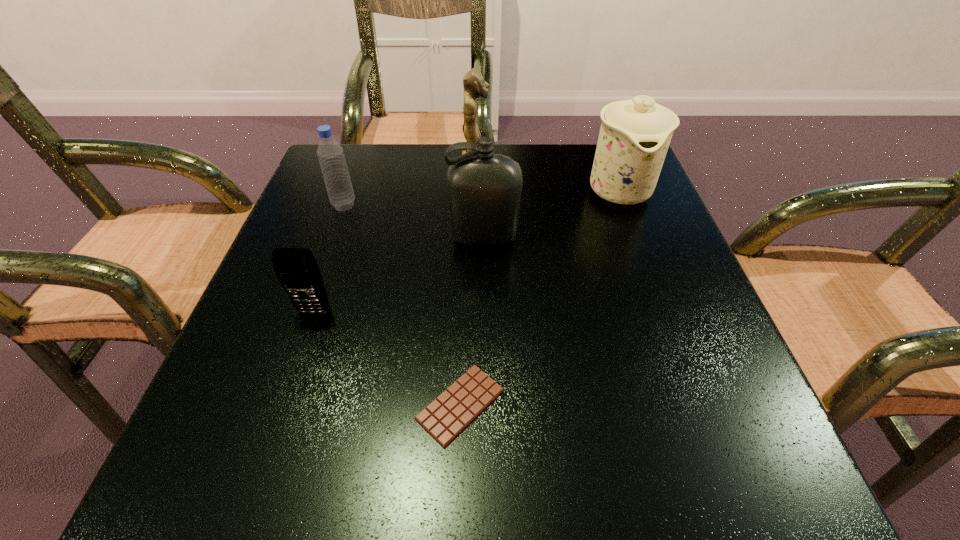
At what (x,y) coordinates should I click in order to perform the action: click on free spot at the far right corner of the desktop. Please return your answer as a coordinate pair (x, y). This screenshot has width=960, height=540. Looking at the image, I should click on (573, 149).

Identify the location of blank area at the near right corner. (673, 444).

Find the location of a particular element. unoccupied area between the nearer bottle and the farther bottle is located at coordinates (414, 221).

Locate an element on the screen. The width and height of the screenshot is (960, 540). free space that is in between the right bottle and the second nearest object is located at coordinates (399, 275).

The height and width of the screenshot is (540, 960). I want to click on unoccupied position between the figurine and the candy bar, so click(x=468, y=286).

What are the coordinates of `unoccupied area between the candy bar and the figurine` in the screenshot? It's located at tap(468, 286).

Locate an element on the screen. unoccupied area between the chinaware and the second nearest object is located at coordinates (466, 251).

Image resolution: width=960 pixels, height=540 pixels. Find the location of `vacant space that's between the taller bottle and the rightmost object`. vacant space that's between the taller bottle and the rightmost object is located at coordinates (551, 214).

Identify the location of vacant area that lies between the nearer bottle and the farther bottle. This screenshot has height=540, width=960. (414, 221).

Where is `vacant space that's between the nearest object and the farther bottle`? This screenshot has height=540, width=960. vacant space that's between the nearest object and the farther bottle is located at coordinates (402, 305).